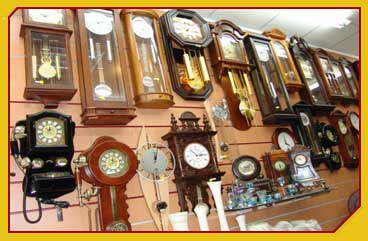
What are the coordinates of `black clock` in the screenshot? It's located at (49, 153).